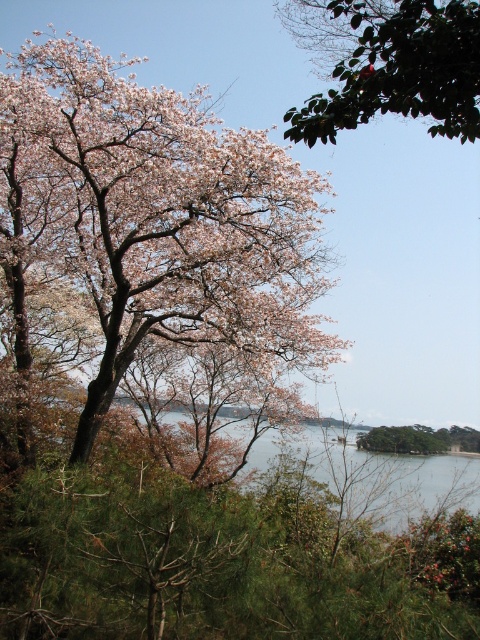
Which is below, pink matte flower at upper left or green glossy leaf at upper center?

pink matte flower at upper left is below.

Who is more distant from viewer, (191, 435) or (332, 96)?

The point (191, 435) is more distant.

The image size is (480, 640). What do you see at coordinates (156, 253) in the screenshot?
I see `pink matte flower at upper left` at bounding box center [156, 253].

This screenshot has width=480, height=640. Find the location of `pink matte flower at upper left`. pink matte flower at upper left is located at coordinates (156, 253).